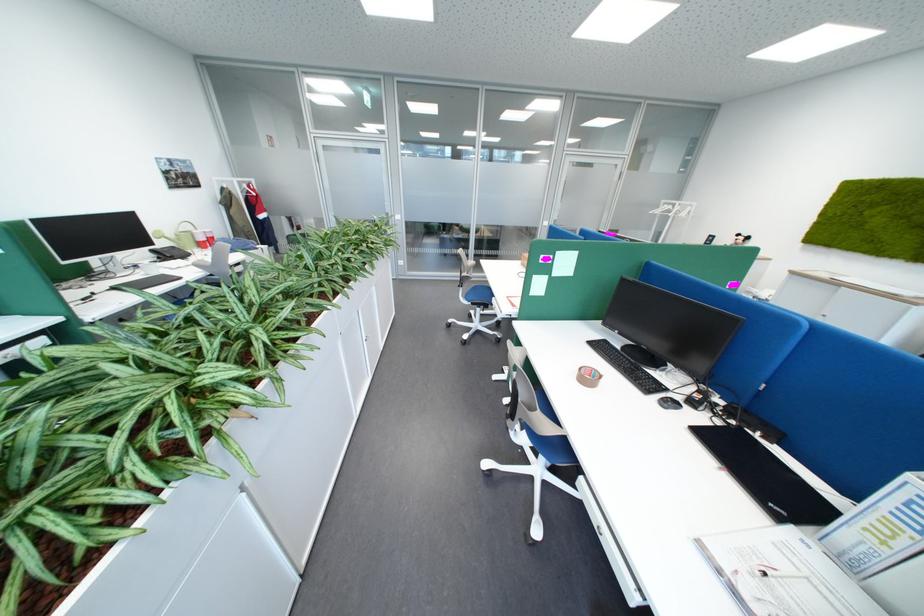
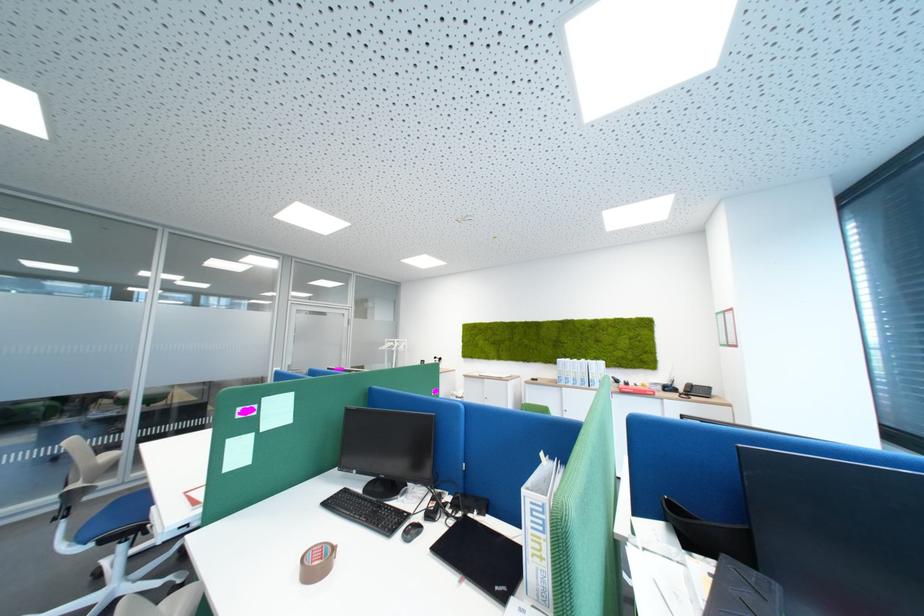
The point at [879,531] is marked in the first image. Where is the corresponding point in the second image?

(545, 556)